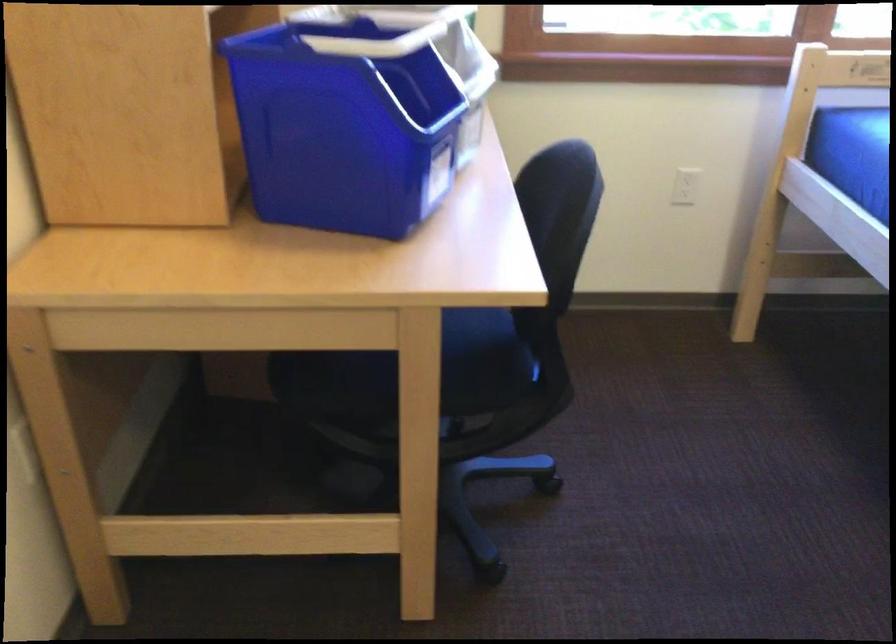
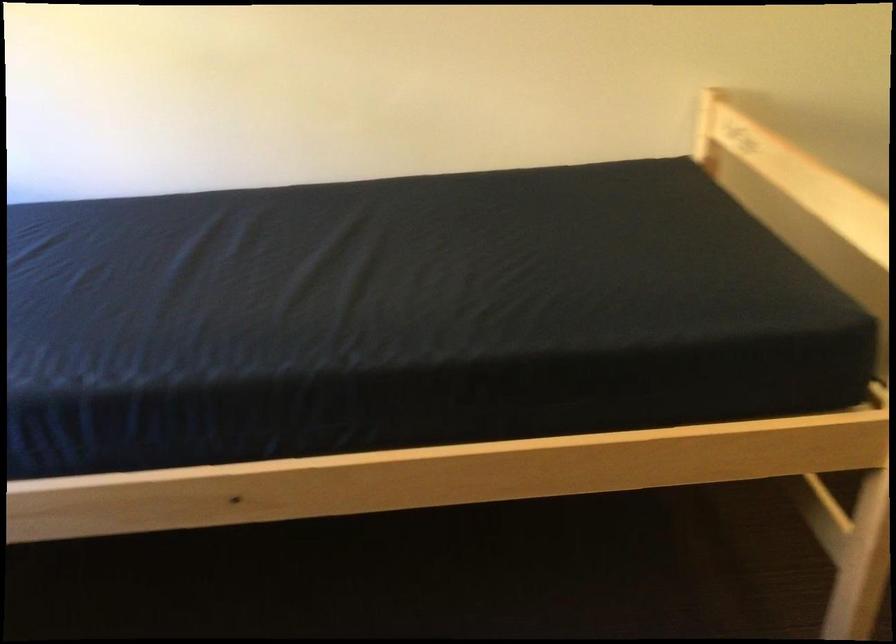
First-person continuous shooting, in which direction is the camera rotating?

The camera's rotation is toward right-down.